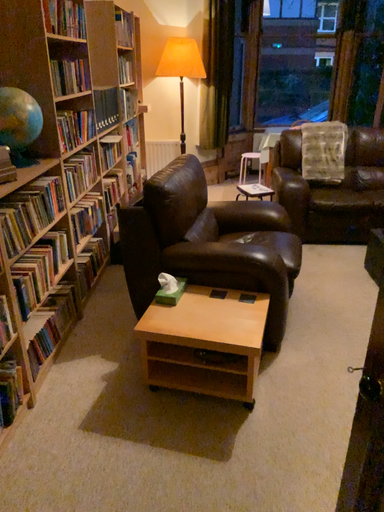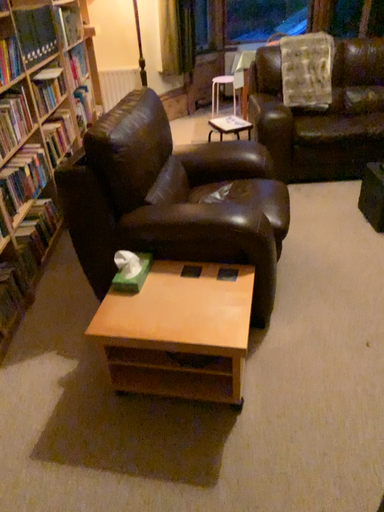
Question: Which way did the camera rotate in the video?

Choices:
 (A) rotated downward
 (B) rotated upward

Answer: (A)